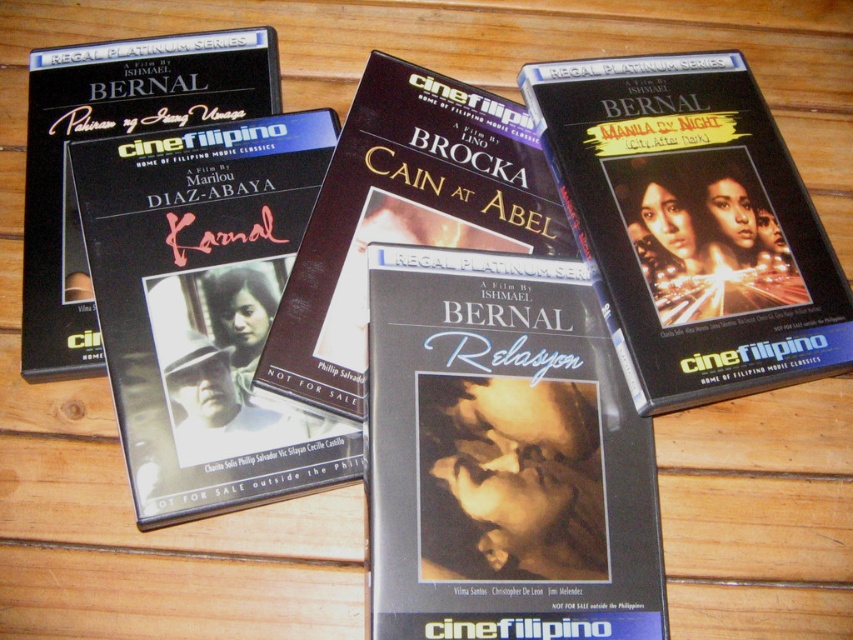
Between matte black dvd case at center and matte black book at center, which one has less height?

matte black book at center is shorter.

Is matte black dvd case at center shorter than matte black book at center?

No.

What do you see at coordinates (204, 307) in the screenshot?
I see `matte black dvd case at center` at bounding box center [204, 307].

Locate an element on the screen. Image resolution: width=853 pixels, height=640 pixels. matte black dvd case at center is located at coordinates (204, 307).

This screenshot has width=853, height=640. Describe the element at coordinates (403, 216) in the screenshot. I see `matte black book at center` at that location.

Who is more forward, (258, 385) or (56, 154)?

Point (258, 385) is more forward.

Where is `matte black book at center`? The width and height of the screenshot is (853, 640). matte black book at center is located at coordinates (403, 216).

Which is more to the left, matte black dvd at center or matte black dvd case at upper right?

Positioned to the left is matte black dvd at center.

Looking at this image, does matte black dvd at center appear under matte black dvd case at upper right?

Yes.

Is point (407, 600) positioned behind point (599, 221)?

No, (407, 600) is in front of (599, 221).

The image size is (853, 640). In order to click on matte black dvd at center in this screenshot , I will do `click(503, 456)`.